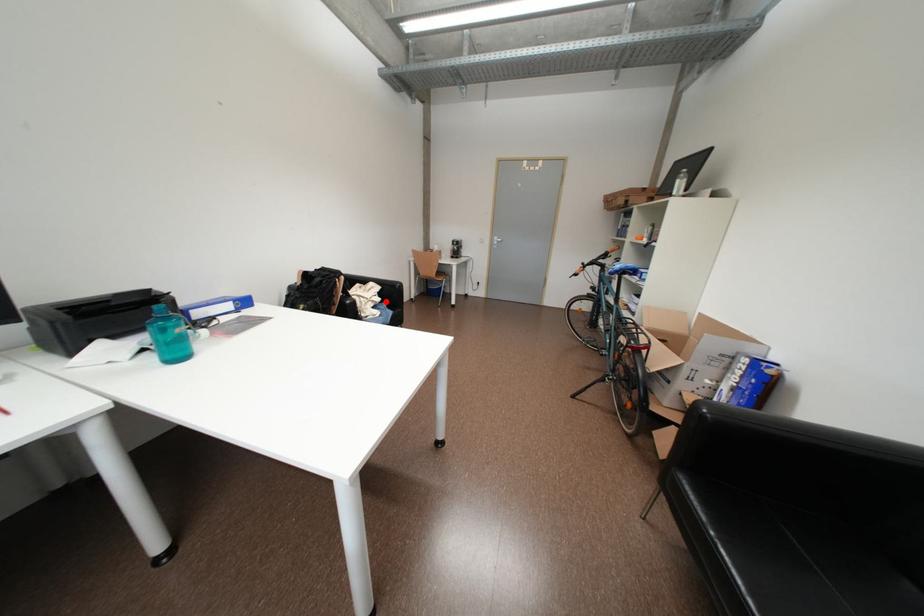
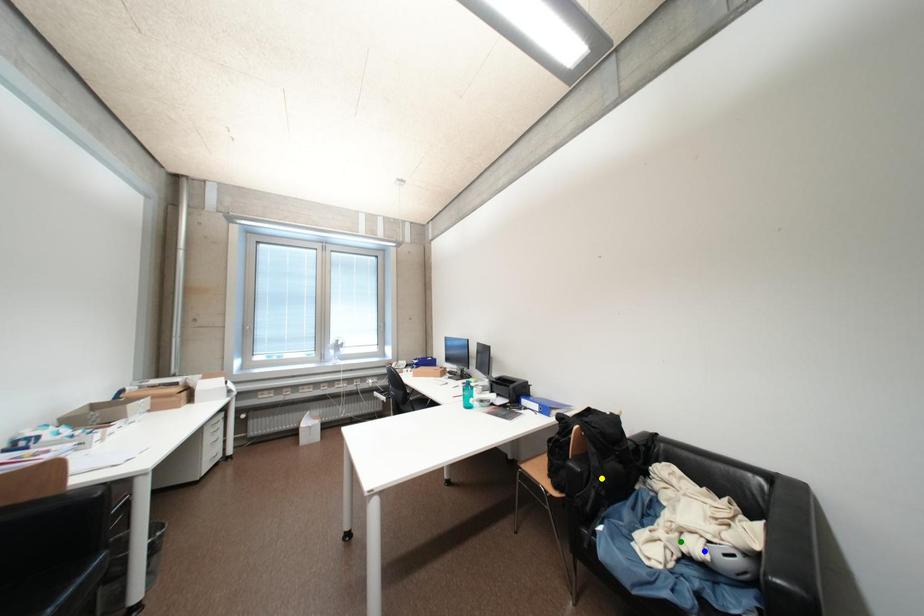
Question: I am providing you with two images of the same scene from different viewpoints. A red point is marked on the first image. You are given multiple points on the second image. Which point in image 2 represents the same 3d spot as the red point in image 1?

Choices:
 (A) green point
 (B) blue point
 (C) yellow point

Answer: (B)